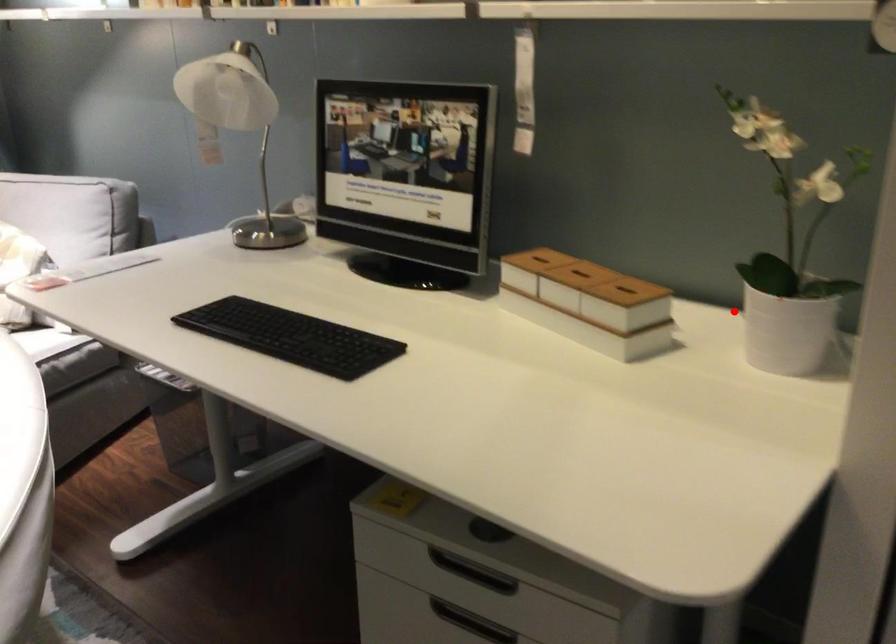
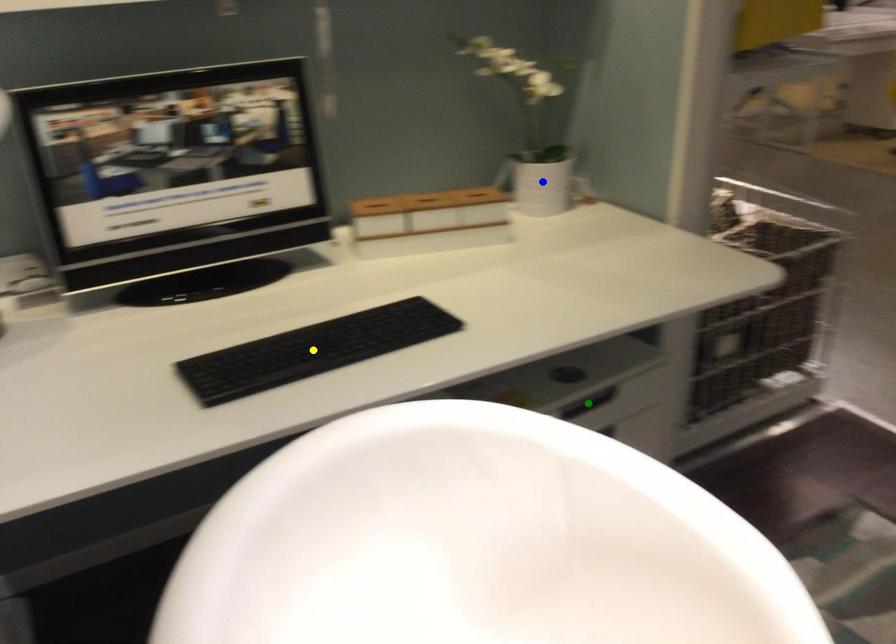
Question: I am providing you with two images of the same scene from different viewpoints. A red point is marked on the first image. You are given multiple points on the second image. Which point in image 2 represents the same 3d spot as the red point in image 1?

Choices:
 (A) green point
 (B) blue point
 (C) yellow point

Answer: (B)